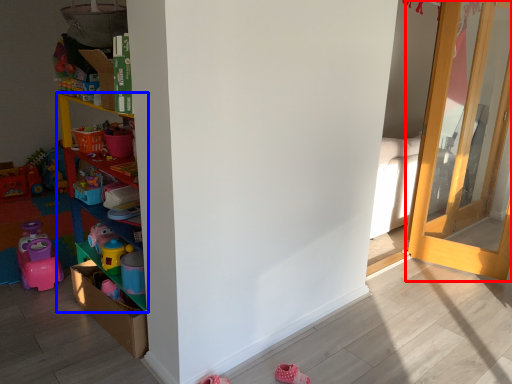
Question: Which object is further to the camera taking this photo, door (highlighted by a red box) or shelf (highlighted by a blue box)?

Choices:
 (A) door
 (B) shelf

Answer: (A)